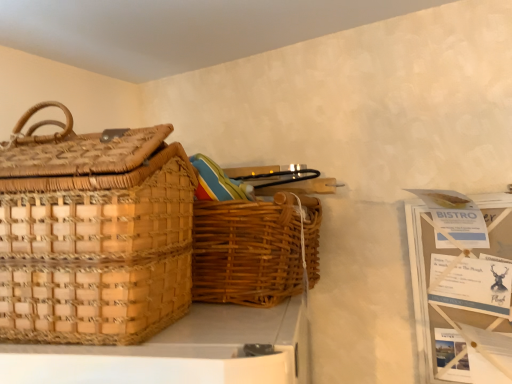
Identify the location of woven natural picnic basket at left, the second picnic basket when ordered from right to left. (93, 234).

Describe the element at coordinates (93, 234) in the screenshot. The image size is (512, 384). I see `woven natural picnic basket at left, which is the 1th picnic basket from left to right` at that location.

In order to face woven natural picnic basket at left, the second picnic basket when ordered from right to left, should I rotate leftwards or rightwards?

Turn left approximately 25.276 degrees to face it.

From the picture: Measure the distance between point (175, 230) and camera.

They are 25.39 inches apart.

How much space does woven brown picnic basket at center, marked as the 1th picnic basket in a right-to-left arrangement, occupy horizontally?

woven brown picnic basket at center, marked as the 1th picnic basket in a right-to-left arrangement, is 31.94 centimeters wide.

Where is `woven brown picnic basket at center, marked as the 1th picnic basket in a right-to-left arrangement`? woven brown picnic basket at center, marked as the 1th picnic basket in a right-to-left arrangement is located at coordinates (254, 250).

The width and height of the screenshot is (512, 384). Describe the element at coordinates (254, 250) in the screenshot. I see `woven brown picnic basket at center, marked as the 1th picnic basket in a right-to-left arrangement` at that location.

How much space does woven brown picnic basket at center, marked as the 1th picnic basket in a right-to-left arrangement, occupy vertically?

It is 10.22 inches.

Locate an element on the screen. woven natural picnic basket at left, the second picnic basket when ordered from right to left is located at coordinates (93, 234).

Is woven natural picnic basket at left, the second picnic basket when ordered from right to left, at the right side of woven brown picnic basket at center, marked as the 1th picnic basket in a right-to-left arrangement?

Incorrect, woven natural picnic basket at left, the second picnic basket when ordered from right to left, is not on the right side of woven brown picnic basket at center, marked as the 1th picnic basket in a right-to-left arrangement.

Is the position of woven natural picnic basket at left, which is the 1th picnic basket from left to right, more distant than that of woven brown picnic basket at center, marked as the 1th picnic basket in a right-to-left arrangement?

That is False.

Based on the photo, which is closer, (11, 309) or (214, 247)?

Point (11, 309).

From the image's perspective, is woven natural picnic basket at left, which is the 1th picnic basket from left to right, located above woven brown picnic basket at center, arranged as the 2th picnic basket when viewed from the left?

Correct, woven natural picnic basket at left, which is the 1th picnic basket from left to right, appears higher than woven brown picnic basket at center, arranged as the 2th picnic basket when viewed from the left, in the image.

From a real-world perspective, which object stands above the other?

In real-world perspective, woven natural picnic basket at left, which is the 1th picnic basket from left to right, is above.

Between woven natural picnic basket at left, the second picnic basket when ordered from right to left, and woven brown picnic basket at center, arranged as the 2th picnic basket when viewed from the left, which one has smaller width?

woven natural picnic basket at left, the second picnic basket when ordered from right to left.

Considering the relative sizes of woven natural picnic basket at left, the second picnic basket when ordered from right to left, and woven brown picnic basket at center, marked as the 1th picnic basket in a right-to-left arrangement, in the image provided, is woven natural picnic basket at left, the second picnic basket when ordered from right to left, shorter than woven brown picnic basket at center, marked as the 1th picnic basket in a right-to-left arrangement,?

No, woven natural picnic basket at left, the second picnic basket when ordered from right to left, is not shorter than woven brown picnic basket at center, marked as the 1th picnic basket in a right-to-left arrangement.

Based on their sizes in the image, would you say woven natural picnic basket at left, which is the 1th picnic basket from left to right, is bigger or smaller than woven brown picnic basket at center, marked as the 1th picnic basket in a right-to-left arrangement?

In the image, woven natural picnic basket at left, which is the 1th picnic basket from left to right, appears to be larger than woven brown picnic basket at center, marked as the 1th picnic basket in a right-to-left arrangement.

Choose the correct answer: Is woven natural picnic basket at left, the second picnic basket when ordered from right to left, inside woven brown picnic basket at center, marked as the 1th picnic basket in a right-to-left arrangement, or outside it?

woven natural picnic basket at left, the second picnic basket when ordered from right to left, is located beyond the bounds of woven brown picnic basket at center, marked as the 1th picnic basket in a right-to-left arrangement.

Would you consider woven natural picnic basket at left, the second picnic basket when ordered from right to left, to be distant from woven brown picnic basket at center, marked as the 1th picnic basket in a right-to-left arrangement?

That's not correct — woven natural picnic basket at left, the second picnic basket when ordered from right to left, is a little close to woven brown picnic basket at center, marked as the 1th picnic basket in a right-to-left arrangement.

Is woven natural picnic basket at left, the second picnic basket when ordered from right to left, aimed at woven brown picnic basket at center, arranged as the 2th picnic basket when viewed from the left?

No, woven natural picnic basket at left, the second picnic basket when ordered from right to left, does not turn towards woven brown picnic basket at center, arranged as the 2th picnic basket when viewed from the left.

Can you tell me how much woven natural picnic basket at left, which is the 1th picnic basket from left to right, and woven brown picnic basket at center, marked as the 1th picnic basket in a right-to-left arrangement, differ in facing direction?

14 degrees.

Where is `picnic basket in front of the woven brown picnic basket at center, marked as the 1th picnic basket in a right-to-left arrangement`? picnic basket in front of the woven brown picnic basket at center, marked as the 1th picnic basket in a right-to-left arrangement is located at coordinates pos(93,234).

Considering the relative positions of woven brown picnic basket at center, marked as the 1th picnic basket in a right-to-left arrangement, and woven natural picnic basket at left, the second picnic basket when ordered from right to left, in the image provided, is woven brown picnic basket at center, marked as the 1th picnic basket in a right-to-left arrangement, to the left of woven natural picnic basket at left, the second picnic basket when ordered from right to left, from the viewer's perspective?

No.

Does woven brown picnic basket at center, arranged as the 2th picnic basket when viewed from the left, lie in front of woven natural picnic basket at left, the second picnic basket when ordered from right to left?

No, woven brown picnic basket at center, arranged as the 2th picnic basket when viewed from the left, is further to the viewer.

Is point (313, 206) more distant than point (111, 250)?

Yes, point (313, 206) is behind point (111, 250).

From the image's perspective, is woven brown picnic basket at center, arranged as the 2th picnic basket when viewed from the left, above woven natural picnic basket at left, the second picnic basket when ordered from right to left?

Incorrect, from the image's perspective, woven brown picnic basket at center, arranged as the 2th picnic basket when viewed from the left, is lower than woven natural picnic basket at left, the second picnic basket when ordered from right to left.

From a real-world perspective, is woven brown picnic basket at center, arranged as the 2th picnic basket when viewed from the left, above or below woven natural picnic basket at left, the second picnic basket when ordered from right to left?

In terms of real-world spatial position, woven brown picnic basket at center, arranged as the 2th picnic basket when viewed from the left, is below woven natural picnic basket at left, the second picnic basket when ordered from right to left.

In terms of width, does woven brown picnic basket at center, marked as the 1th picnic basket in a right-to-left arrangement, look wider or thinner when compared to woven natural picnic basket at left, which is the 1th picnic basket from left to right?

woven brown picnic basket at center, marked as the 1th picnic basket in a right-to-left arrangement, is wider than woven natural picnic basket at left, which is the 1th picnic basket from left to right.

Can you confirm if woven brown picnic basket at center, marked as the 1th picnic basket in a right-to-left arrangement, is shorter than woven natural picnic basket at left, which is the 1th picnic basket from left to right?

Indeed, woven brown picnic basket at center, marked as the 1th picnic basket in a right-to-left arrangement, has a lesser height compared to woven natural picnic basket at left, which is the 1th picnic basket from left to right.

Considering the relative sizes of woven brown picnic basket at center, arranged as the 2th picnic basket when viewed from the left, and woven natural picnic basket at left, the second picnic basket when ordered from right to left, in the image provided, is woven brown picnic basket at center, arranged as the 2th picnic basket when viewed from the left, smaller than woven natural picnic basket at left, the second picnic basket when ordered from right to left,?

Yes.

Is woven brown picnic basket at center, marked as the 1th picnic basket in a right-to-left arrangement, completely or partially outside of woven natural picnic basket at left, which is the 1th picnic basket from left to right?

Yes.

Are woven brown picnic basket at center, marked as the 1th picnic basket in a right-to-left arrangement, and woven natural picnic basket at left, the second picnic basket when ordered from right to left, far apart?

Actually, woven brown picnic basket at center, marked as the 1th picnic basket in a right-to-left arrangement, and woven natural picnic basket at left, the second picnic basket when ordered from right to left, are a little close together.

Does woven brown picnic basket at center, arranged as the 2th picnic basket when viewed from the left, turn towards woven natural picnic basket at left, the second picnic basket when ordered from right to left?

Yes, woven brown picnic basket at center, arranged as the 2th picnic basket when viewed from the left, is turned towards woven natural picnic basket at left, the second picnic basket when ordered from right to left.

What's the angular difference between woven brown picnic basket at center, marked as the 1th picnic basket in a right-to-left arrangement, and woven natural picnic basket at left, the second picnic basket when ordered from right to left,'s facing directions?

There is a 14-degree angle between the facing directions of woven brown picnic basket at center, marked as the 1th picnic basket in a right-to-left arrangement, and woven natural picnic basket at left, the second picnic basket when ordered from right to left.

Measure the distance from woven brown picnic basket at center, marked as the 1th picnic basket in a right-to-left arrangement, to woven natural picnic basket at left, the second picnic basket when ordered from right to left.

The distance of woven brown picnic basket at center, marked as the 1th picnic basket in a right-to-left arrangement, from woven natural picnic basket at left, the second picnic basket when ordered from right to left, is 8.13 inches.

Find the location of a particular element. picnic basket above the woven brown picnic basket at center, marked as the 1th picnic basket in a right-to-left arrangement (from the image's perspective) is located at coordinates (93, 234).

This screenshot has width=512, height=384. In order to click on picnic basket that appears above the woven brown picnic basket at center, arranged as the 2th picnic basket when viewed from the left (from a real-world perspective) in this screenshot , I will do `click(93, 234)`.

This screenshot has width=512, height=384. I want to click on picnic basket above the woven brown picnic basket at center, marked as the 1th picnic basket in a right-to-left arrangement (from the image's perspective), so click(x=93, y=234).